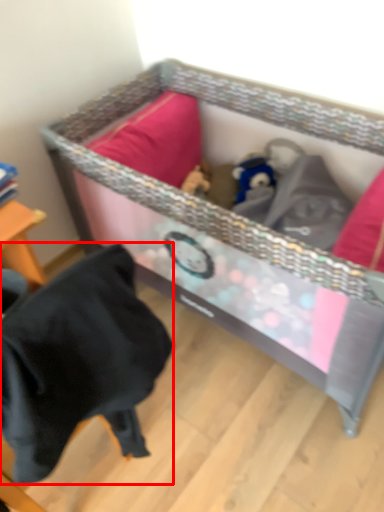
Question: From the image, what is the correct spatial relationship of clothing (annotated by the red box) in relation to infant bed?

Choices:
 (A) left
 (B) right

Answer: (A)